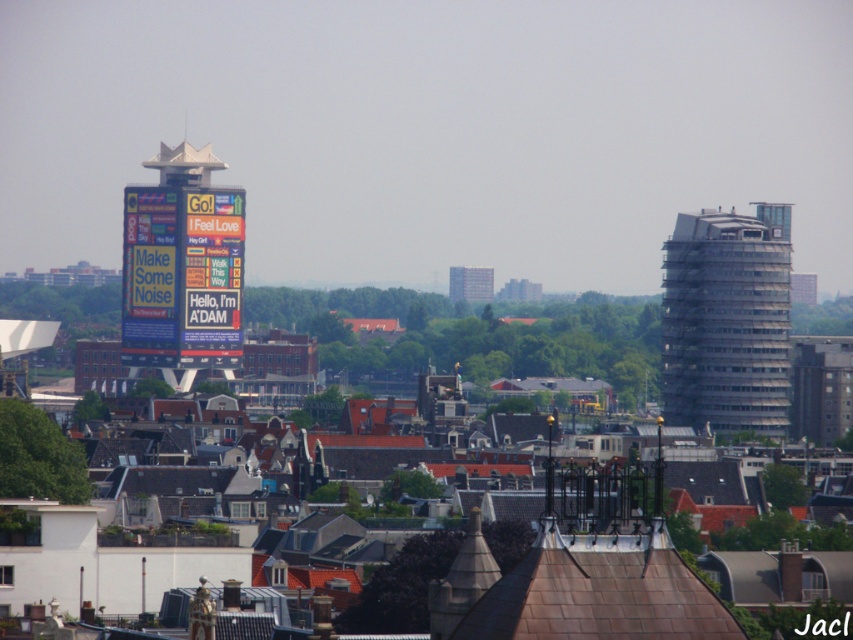
Is slate gray glass building at right smaller than gray concrete building at center?

No.

Measure the distance between slate gray glass building at right and camera.

slate gray glass building at right and camera are 660.06 meters apart from each other.

The height and width of the screenshot is (640, 853). Find the location of `slate gray glass building at right`. slate gray glass building at right is located at coordinates pyautogui.click(x=727, y=321).

Who is more forward, (757, 291) or (177, 156)?

Point (177, 156) is more forward.

Is point (709, 273) behind point (231, 305)?

Yes, point (709, 273) is behind point (231, 305).

Is point (665, 246) positioned before point (173, 333)?

No, it is not.

This screenshot has width=853, height=640. Identify the location of slate gray glass building at right. (727, 321).

Based on the photo, is multicolored digital billboard at center smaller than gray concrete building at center?

Incorrect, multicolored digital billboard at center is not smaller in size than gray concrete building at center.

Is multicolored digital billboard at center thinner than gray concrete building at center?

In fact, multicolored digital billboard at center might be wider than gray concrete building at center.

Is point (137, 308) behind point (490, 289)?

That is True.

This screenshot has width=853, height=640. Identify the location of multicolored digital billboard at center. (183, 264).